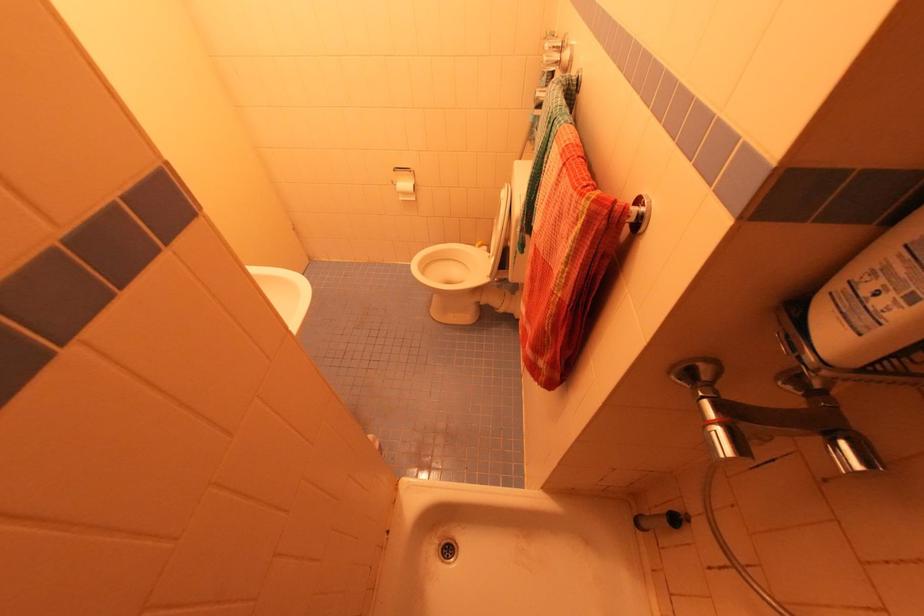
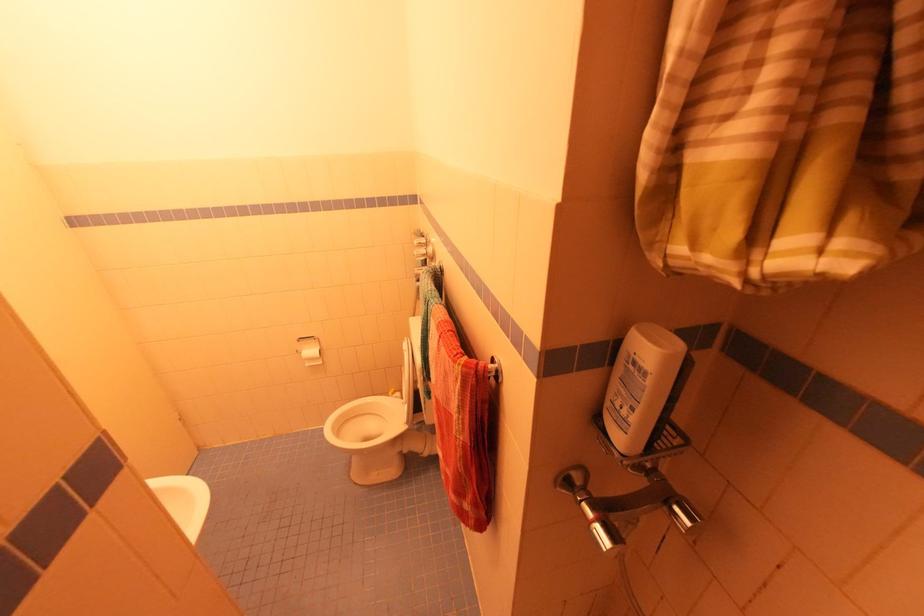
In the second image, find the point that corresponds to (x=410, y=169) in the first image.

(314, 338)